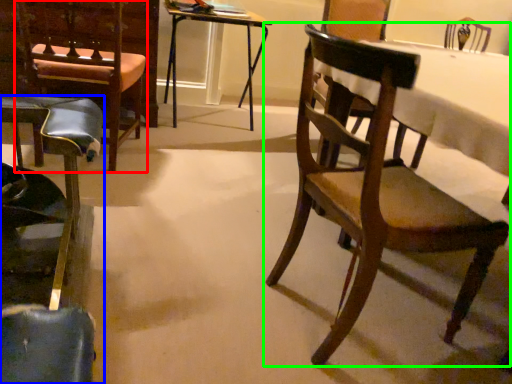
Question: Based on their relative distances, which object is nearer to armchair (highlighted by a red box)? Choose from chair (highlighted by a blue box) and chair (highlighted by a green box).

Choices:
 (A) chair
 (B) chair

Answer: (A)